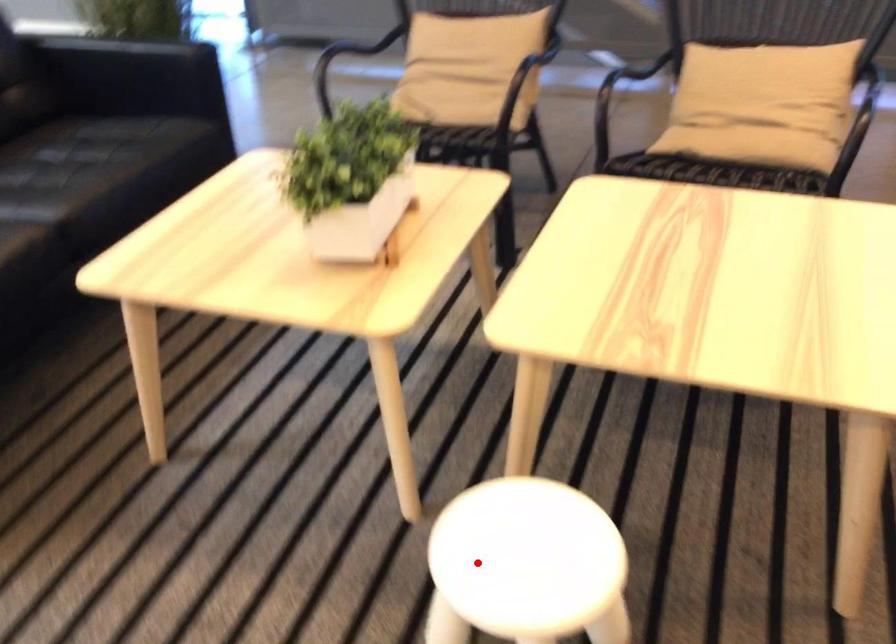
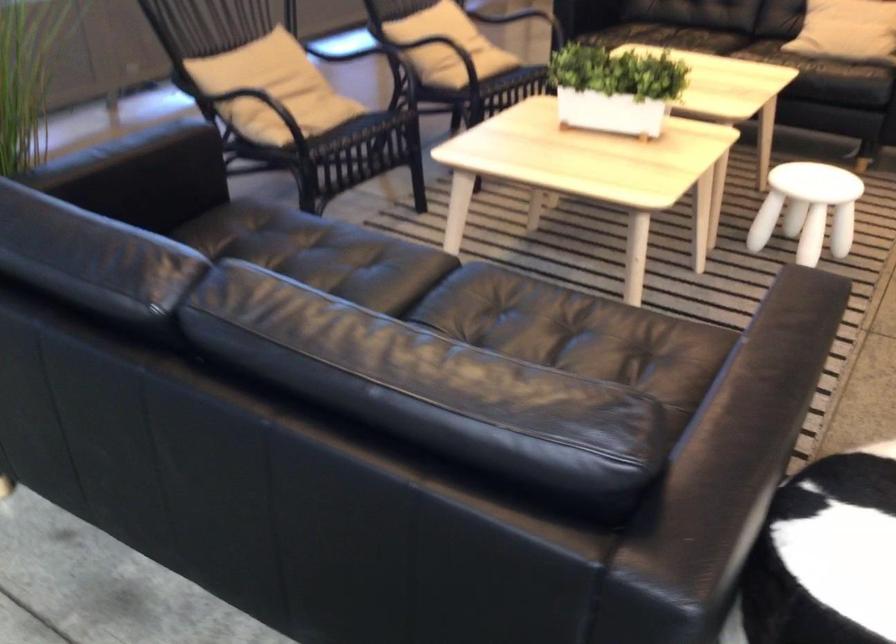
Find the pixel in the second image that matches the highlighted location in the first image.

(807, 209)